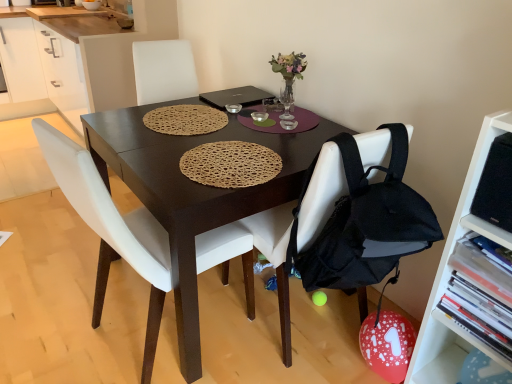
The height and width of the screenshot is (384, 512). What do you see at coordinates (193, 192) in the screenshot? I see `dark wood table at center` at bounding box center [193, 192].

At what (x,y) coordinates should I click in order to perform the action: click on white fabric chair at center, which appears as the 2th chair when viewed from the left. Please return your answer as a coordinate pair (x, y). Looking at the image, I should click on (276, 258).

What do you see at coordinates (81, 58) in the screenshot? This screenshot has height=384, width=512. I see `white matte cabinet at upper left` at bounding box center [81, 58].

Find the location of `dark wood table at center`. dark wood table at center is located at coordinates (193, 192).

Is white fabric chair at center, which appears as the 2th chair when viewed from the left, closer to the viewer compared to white matte cabinet at upper left?

Yes, it is in front of white matte cabinet at upper left.

From the image's perspective, which one is positioned lower, white fabric chair at center, which appears as the 2th chair when viewed from the left, or white matte cabinet at upper left?

white fabric chair at center, which appears as the 2th chair when viewed from the left, is shown below in the image.

From a real-world perspective, is white fabric chair at center, which ranks as the first chair in right-to-left order, physically below white matte cabinet at upper left?

No, from a real-world perspective, white fabric chair at center, which ranks as the first chair in right-to-left order, is not beneath white matte cabinet at upper left.

Is white matte cabinet at upper left at the left side of dark wood table at center?

Yes, white matte cabinet at upper left is to the left of dark wood table at center.

Can you tell me how much white matte cabinet at upper left and dark wood table at center differ in facing direction?

The angle between the facing direction of white matte cabinet at upper left and the facing direction of dark wood table at center is 0.398 degrees.

Is there a large distance between white matte cabinet at upper left and dark wood table at center?

That's right, there is a large distance between white matte cabinet at upper left and dark wood table at center.

From the picture: Could dark wood table at center be considered to be inside white matte cabinet at upper left?

No, white matte cabinet at upper left does not contain dark wood table at center.

Considering the relative sizes of woven brown placemat at center and white leather chair at center, positioned as the second chair in right-to-left order, in the image provided, is woven brown placemat at center thinner than white leather chair at center, positioned as the second chair in right-to-left order,?

Yes, woven brown placemat at center is thinner than white leather chair at center, positioned as the second chair in right-to-left order.

Which is in front, woven brown placemat at center or white leather chair at center, positioned as the second chair in right-to-left order?

white leather chair at center, positioned as the second chair in right-to-left order.

Choose the correct answer: Is woven brown placemat at center inside white leather chair at center, positioned as the second chair in right-to-left order, or outside it?

The correct answer is: outside.

From the image's perspective, which one is positioned higher, white fabric chair at center, which appears as the 2th chair when viewed from the left, or woven brown placemat at center?

woven brown placemat at center is shown above in the image.

In the scene shown: Would you say white fabric chair at center, which ranks as the first chair in right-to-left order, contains woven brown placemat at center?

No, white fabric chair at center, which ranks as the first chair in right-to-left order, does not contain woven brown placemat at center.

Is white fabric chair at center, which appears as the 2th chair when viewed from the left, turned away from woven brown placemat at center?

white fabric chair at center, which appears as the 2th chair when viewed from the left, does not have its back to woven brown placemat at center.

Is point (310, 210) less distant than point (210, 131)?

Yes, it is in front of point (210, 131).

From a real-world perspective, which object rests below the other?

white matte cabinet at upper left, from a real-world perspective.

Does white leather chair at center, arranged as the 1th chair when viewed from the left, have a greater width compared to white matte cabinet at upper left?

No.

Does white leather chair at center, arranged as the 1th chair when viewed from the left, have a lesser height compared to white matte cabinet at upper left?

Incorrect, the height of white leather chair at center, arranged as the 1th chair when viewed from the left, does not fall short of that of white matte cabinet at upper left.

Is dark wood table at center in contact with black matte laptop at center?

dark wood table at center is not next to black matte laptop at center, and they're not touching.

From a real-world perspective, is dark wood table at center located higher than black matte laptop at center?

Actually, dark wood table at center is physically below black matte laptop at center in the real world.

Is point (93, 321) less distant than point (249, 104)?

That is True.

Is dark wood table at center positioned with its back to black matte laptop at center?

dark wood table at center is not turned away from black matte laptop at center.

Considering the points (378, 137) and (464, 233), which point is behind, point (378, 137) or point (464, 233)?

The point (378, 137) is farther from the camera.

Does white fabric chair at center, which appears as the 2th chair when viewed from the left, appear on the left side of white plastic shelf at right?

Yes.

From the picture: Is there a large distance between white fabric chair at center, which ranks as the first chair in right-to-left order, and white plastic shelf at right?

No.

The width and height of the screenshot is (512, 384). Identify the location of cabinetry located behind the white fabric chair at center, which ranks as the first chair in right-to-left order. (81, 58).

Locate an element on the screen. cabinetry above the dark wood table at center (from the image's perspective) is located at coordinates (81, 58).

Considering their positions, is woven brown placemat at center positioned closer to white leather chair at center, arranged as the 1th chair when viewed from the left, than white matte cabinet at upper left?

Based on the image, woven brown placemat at center appears to be nearer to white leather chair at center, arranged as the 1th chair when viewed from the left.

Which object lies nearer to the anchor point white leather chair at center, positioned as the second chair in right-to-left order, white plastic shelf at right or white fabric chair at center, which appears as the 2th chair when viewed from the left?

Based on the image, white fabric chair at center, which appears as the 2th chair when viewed from the left, appears to be nearer to white leather chair at center, positioned as the second chair in right-to-left order.

Looking at the image, which one is located closer to dark wood table at center, white leather chair at center, arranged as the 1th chair when viewed from the left, or white matte cabinet at upper left?

white leather chair at center, arranged as the 1th chair when viewed from the left, lies closer to dark wood table at center than the other object.

Estimate the real-world distances between objects in this image. Which object is closer to white fabric chair at center, which ranks as the first chair in right-to-left order, black matte laptop at center or woven brown placemat at center?

woven brown placemat at center lies closer to white fabric chair at center, which ranks as the first chair in right-to-left order, than the other object.

From the image, which object appears to be farther from dark wood table at center, black matte laptop at center or white matte cabinet at upper left?

white matte cabinet at upper left is further to dark wood table at center.

Considering their positions, is white plastic shelf at right positioned closer to dark wood table at center than white matte cabinet at upper left?

Based on the image, white plastic shelf at right appears to be nearer to dark wood table at center.

Looking at the image, which one is located closer to black matte laptop at center, white leather chair at center, positioned as the second chair in right-to-left order, or woven brown placemat at center?

woven brown placemat at center.

From the image, which object appears to be farther from white fabric chair at center, which ranks as the first chair in right-to-left order, black matte laptop at center or dark wood table at center?

Among the two, black matte laptop at center is located further to white fabric chair at center, which ranks as the first chair in right-to-left order.

This screenshot has width=512, height=384. What are the coordinates of `mat between white fabric chair at center, which ranks as the first chair in right-to-left order, and black matte laptop at center from front to back` in the screenshot? It's located at pos(185,120).

Identify the location of laptop located between dark wood table at center and white matte cabinet at upper left in the depth direction. Image resolution: width=512 pixels, height=384 pixels. (236, 97).

Locate an element on the screen. The height and width of the screenshot is (384, 512). chair between white leather chair at center, arranged as the 1th chair when viewed from the left, and white plastic shelf at right, in the horizontal direction is located at coordinates (276, 258).

Where is `mat located between white leather chair at center, positioned as the second chair in right-to-left order, and black matte laptop at center in the depth direction`? This screenshot has height=384, width=512. mat located between white leather chair at center, positioned as the second chair in right-to-left order, and black matte laptop at center in the depth direction is located at coordinates (185, 120).